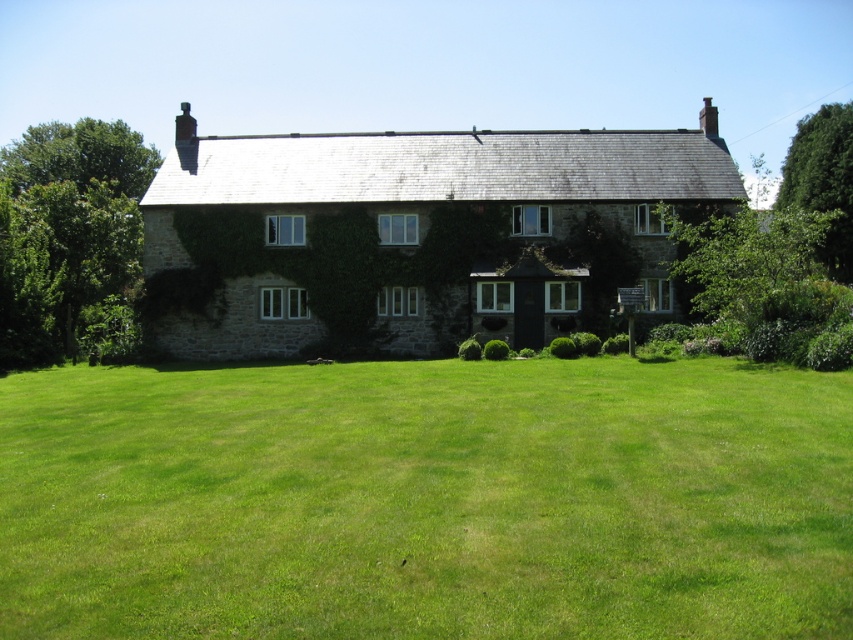
You are planning to place a large garden statue that requires a 3x3 meter space. Given the green grass at center and the stone cottage at center, which area can accommodate the statue?

The stone cottage at center is larger than the green grass at center, so the statue cannot be placed there. The green grass at center is too small to fit the statue.

Consider the image. You are planning to install a garden pathway between the green grass at center and the stone cottage at center. If the pathway needs to be 60 feet long to reach the cottage, will it be sufficient?

The green grass at center is 61.17 feet from the stone cottage at center. Since the pathway is only 60 feet long, it will be 1.17 feet short and not sufficient to reach the cottage.

In the scene shown: You are standing in front of the stone house and want to walk from the green grass at center to the stone cottage at center. In which direction should you move?

You should move to the right because the green grass at center is to the left of the stone cottage at center, so moving right will take you towards the cottage.